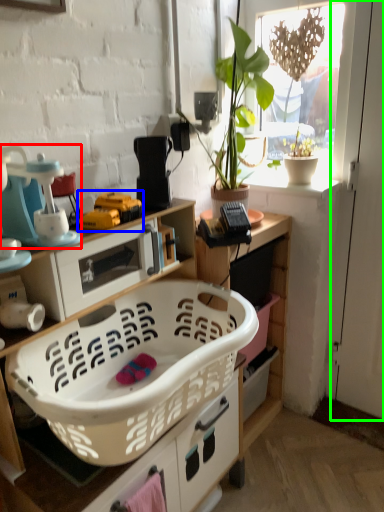
Question: Which object is positioned closest to appliance (highlighted by a red box)? Select from toy (highlighted by a blue box) and screen door (highlighted by a green box).

Choices:
 (A) toy
 (B) screen door

Answer: (A)